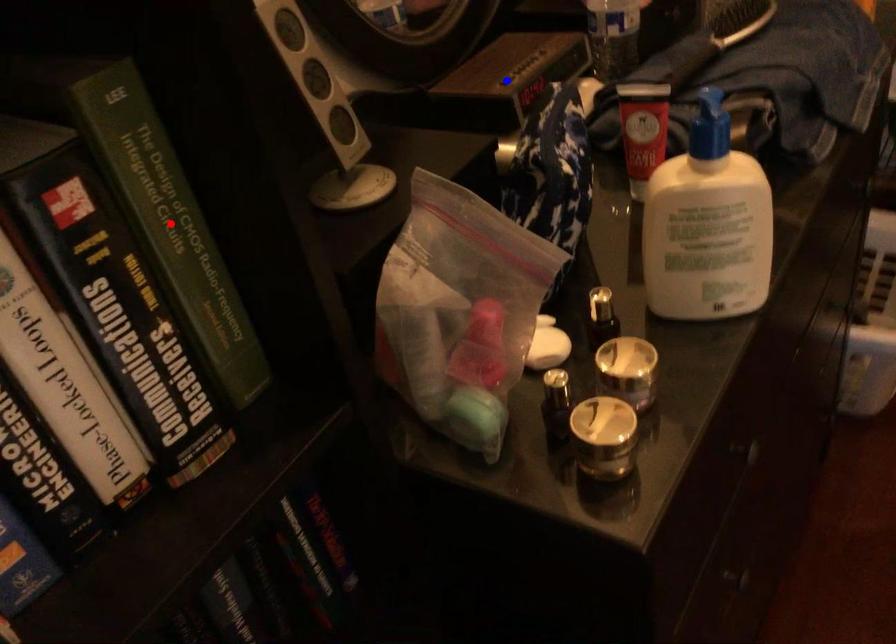
Question: In the image, two points are highlighted. Which point is nearer to the camera? Reply with the corresponding letter.

Choices:
 (A) blue point
 (B) red point

Answer: (B)